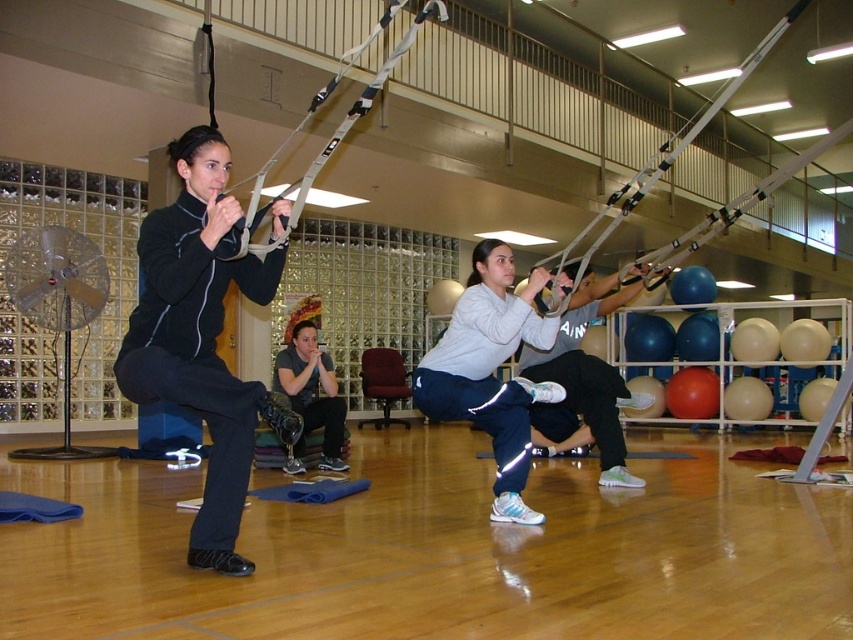
Consider the image. Who is taller, white matte squat at center or matte black prosthetic leg at center?

white matte squat at center

Does point (585, 320) come farther from viewer compared to point (335, 444)?

That is False.

The image size is (853, 640). Describe the element at coordinates (584, 381) in the screenshot. I see `white matte squat at center` at that location.

This screenshot has width=853, height=640. What are the coordinates of `white matte squat at center` in the screenshot? It's located at (584, 381).

Which is more to the left, white matte athletic pants at center or matte black prosthetic leg at center?

matte black prosthetic leg at center is more to the left.

Is white matte athletic pants at center wider than matte black prosthetic leg at center?

Correct, the width of white matte athletic pants at center exceeds that of matte black prosthetic leg at center.

Who is more distant from viewer, (x=483, y=300) or (x=334, y=387)?

The point (x=334, y=387) is more distant.

Identify the location of white matte athletic pants at center. The height and width of the screenshot is (640, 853). (491, 371).

Measure the distance between point (479, 324) and camera.

A distance of 3.60 meters exists between point (479, 324) and camera.

Does white matte athletic pants at center have a greater height compared to white matte squat at center?

In fact, white matte athletic pants at center may be shorter than white matte squat at center.

Is point (505, 500) farther from viewer compared to point (561, 317)?

No, (505, 500) is closer to viewer.

At what (x,y) coordinates should I click in order to perform the action: click on white matte athletic pants at center. Please return your answer as a coordinate pair (x, y). The width and height of the screenshot is (853, 640). Looking at the image, I should click on (491, 371).